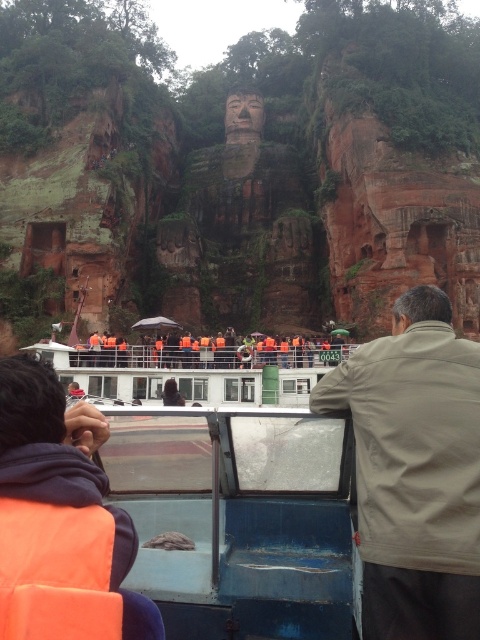
Question: Is orange fabric jacket at lower left positioned at the back of dark brown leather jacket at center?

Choices:
 (A) yes
 (B) no

Answer: (B)

Question: Which point is closer to the camera?

Choices:
 (A) orange fabric jacket at lower left
 (B) beige fabric jacket at upper right

Answer: (A)

Question: Which of the following is the farthest from the observer?

Choices:
 (A) (167, 394)
 (B) (367, 448)

Answer: (A)

Question: Is orange fabric jacket at lower left to the left of dark brown leather jacket at center from the viewer's perspective?

Choices:
 (A) yes
 (B) no

Answer: (A)

Question: Which object is the farthest from the orange fabric jacket at lower left?

Choices:
 (A) beige fabric jacket at upper right
 (B) dark brown leather jacket at center

Answer: (B)

Question: Does beige fabric jacket at upper right appear on the left side of dark brown leather jacket at center?

Choices:
 (A) no
 (B) yes

Answer: (A)